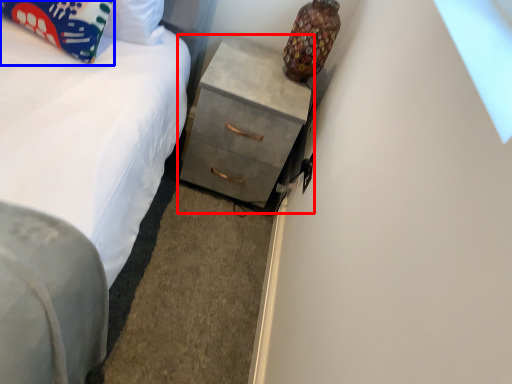
Question: Which object appears farthest to the camera in this image, chest of drawers (highlighted by a red box) or pillow (highlighted by a blue box)?

Choices:
 (A) chest of drawers
 (B) pillow

Answer: (A)